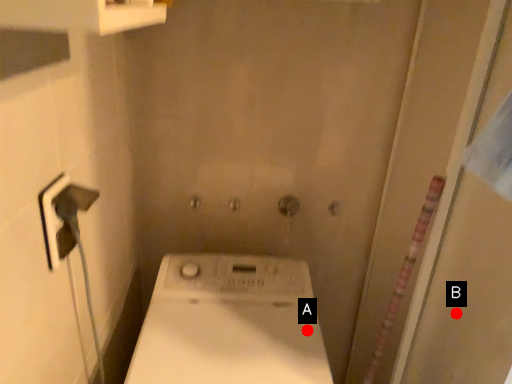
Question: Two points are circled on the image, labeled by A and B beside each circle. Which point is farther to the camera?

Choices:
 (A) A is further
 (B) B is further

Answer: (A)